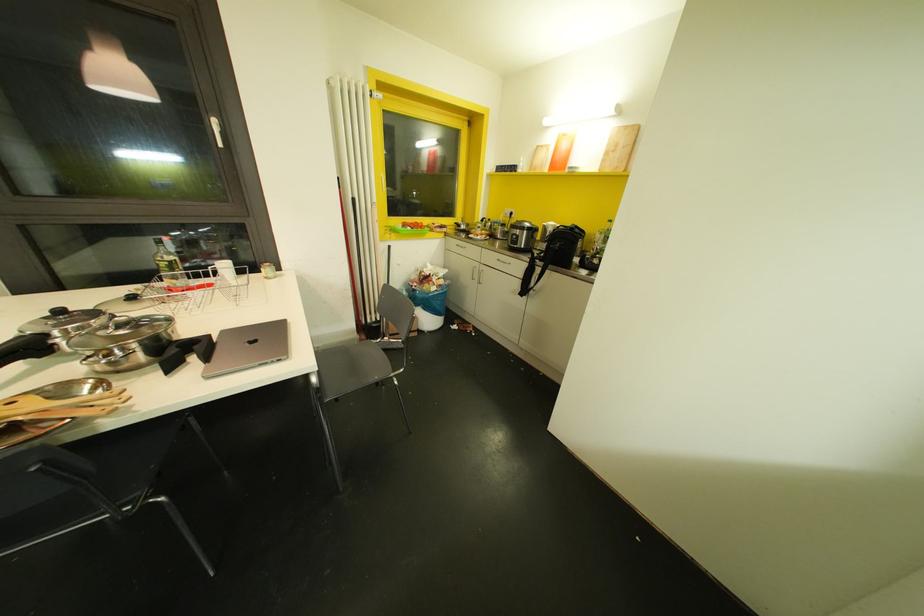
Where would you grasp the black bag strap? Please return your answer as a coordinate pair (x, y).

(562, 246)